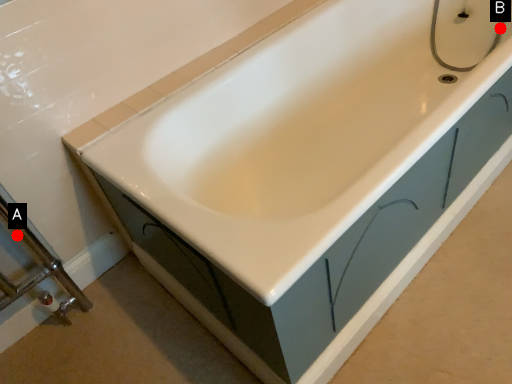
Question: Two points are circled on the image, labeled by A and B beside each circle. Which point is farther to the camera?

Choices:
 (A) A is further
 (B) B is further

Answer: (B)